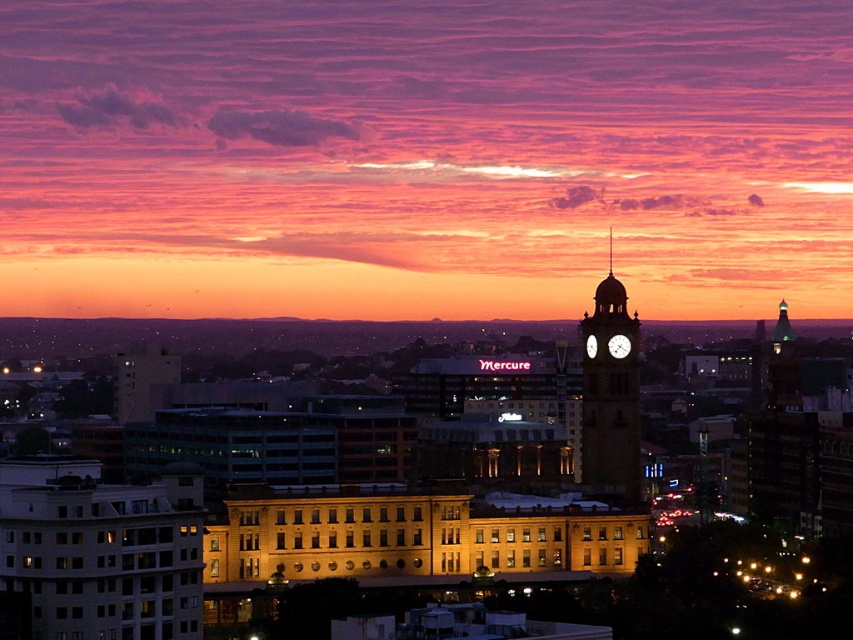
Question: Can you confirm if matte gold clock tower at center is smaller than metallic clock face at center?

Choices:
 (A) yes
 (B) no

Answer: (B)

Question: Which point appears farthest from the camera in this image?

Choices:
 (A) [610, 310]
 (B) [592, 340]
 (C) [610, 344]
 (D) [621, 371]

Answer: (A)

Question: Does white glossy clock tower at center appear on the right side of white glossy clock at center-right?

Choices:
 (A) no
 (B) yes

Answer: (B)

Question: Which point is farther to the camera?

Choices:
 (A) matte gold clock tower at center
 (B) white glossy clock at center-right
 (C) white glossy clock tower at center

Answer: (A)

Question: Which of the following is the closest to the observer?

Choices:
 (A) matte gold clock tower at center
 (B) metallic clock face at center
 (C) white glossy clock at center-right
 (D) white glossy clock tower at center

Answer: (D)

Question: Is white glossy clock tower at center above matte gold clock tower at center?

Choices:
 (A) yes
 (B) no

Answer: (B)